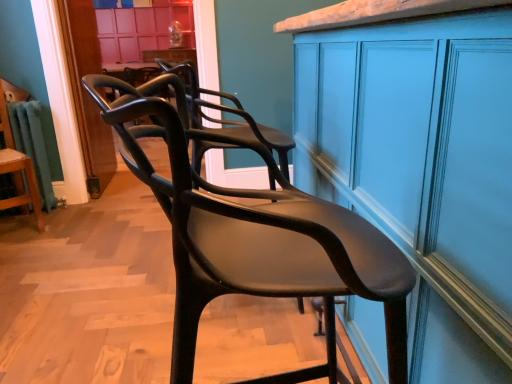
Question: In the image, is matte blue cabinet at center positioned in front of or behind matte black chair at center, positioned as the first chair in right-to-left order?

Choices:
 (A) behind
 (B) front

Answer: (B)

Question: From the image's perspective, is matte blue cabinet at center located above or below matte black chair at center, placed as the first chair when sorted from front to back?

Choices:
 (A) above
 (B) below

Answer: (A)

Question: Which is nearer to the matte black chair at left, marked as the second chair in a right-to-left arrangement?

Choices:
 (A) matte black chair at center, positioned as the first chair in right-to-left order
 (B) matte blue cabinet at center

Answer: (B)

Question: Which object is positioned closest to the matte blue cabinet at center?

Choices:
 (A) matte black chair at left, which is counted as the first chair, starting from the left
 (B) matte black chair at center, the 2th chair from the left

Answer: (B)